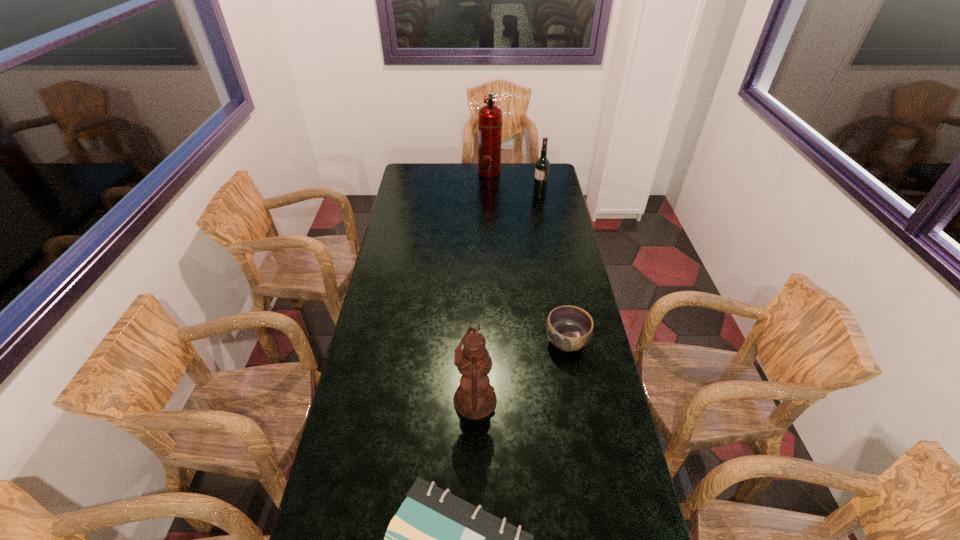
Locate an element on the screen. This screenshot has height=540, width=960. free space between the third nearest object and the tallest object is located at coordinates click(x=528, y=256).

I want to click on empty space between the second nearest object and the farthest object, so click(482, 286).

The width and height of the screenshot is (960, 540). Find the location of `empty location between the bowl and the fire extinguisher`. empty location between the bowl and the fire extinguisher is located at coordinates tap(528, 256).

Where is `free point between the second farthest object and the tallest object`? The height and width of the screenshot is (540, 960). free point between the second farthest object and the tallest object is located at coordinates (515, 184).

You are a GUI agent. You are given a task and a screenshot of the screen. Output one action in this format:
    pyautogui.click(x=<x>, y=<y>)
    Task: Click on the unoccupied position between the third farthest object and the second nearest object
    
    Given the screenshot: What is the action you would take?
    pyautogui.click(x=521, y=371)

At what (x,y) coordinates should I click in order to perform the action: click on object identified as the third closest to the wine bottle. Please return your answer as a coordinate pair (x, y). Looking at the image, I should click on (475, 398).

You are a GUI agent. You are given a task and a screenshot of the screen. Output one action in this format:
    pyautogui.click(x=<x>, y=<y>)
    Task: Click on the closest object to the wine bottle
    This screenshot has width=960, height=540.
    Given the screenshot: What is the action you would take?
    pyautogui.click(x=490, y=116)

Where is `vacant space that satisfies the following two spatial constraints: 1. on the nozzle side of the third nearest object; 2. on the right side of the fire extinguisher`? The height and width of the screenshot is (540, 960). vacant space that satisfies the following two spatial constraints: 1. on the nozzle side of the third nearest object; 2. on the right side of the fire extinguisher is located at coordinates (494, 341).

You are a GUI agent. You are given a task and a screenshot of the screen. Output one action in this format:
    pyautogui.click(x=<x>, y=<y>)
    Task: Click on the vacant space that satisfies the following two spatial constraints: 1. on the nozzle side of the farthest object; 2. on the left side of the bowl
    This screenshot has width=960, height=540.
    Given the screenshot: What is the action you would take?
    pyautogui.click(x=494, y=341)

Locate an element on the screen. The image size is (960, 540). free space that satisfies the following two spatial constraints: 1. on the nozzle side of the third farthest object; 2. on the right side of the farthest object is located at coordinates (494, 341).